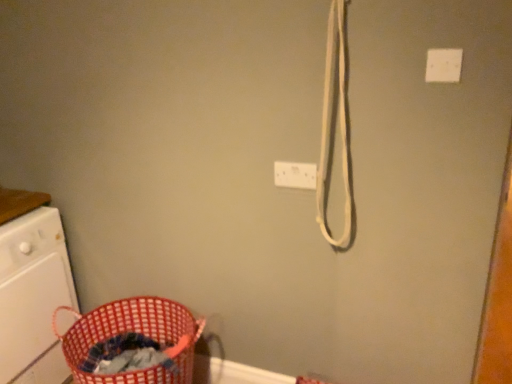
Question: Considering the relative positions of white plastic electric outlet at upper center and white plastic light switch at upper right in the image provided, is white plastic electric outlet at upper center to the left or to the right of white plastic light switch at upper right?

Choices:
 (A) left
 (B) right

Answer: (A)

Question: Looking at their shapes, would you say white plastic electric outlet at upper center is wider or thinner than white plastic light switch at upper right?

Choices:
 (A) wide
 (B) thin

Answer: (A)

Question: Which is farther from the white plastic light switch at upper right?

Choices:
 (A) white plastic washing machine at left
 (B) red woven laundry basket at lower left
 (C) white plastic electric outlet at upper center

Answer: (A)

Question: Estimate the real-world distances between objects in this image. Which object is farther from the white plastic light switch at upper right?

Choices:
 (A) white plastic washing machine at left
 (B) red woven laundry basket at lower left
 (C) white plastic electric outlet at upper center

Answer: (A)